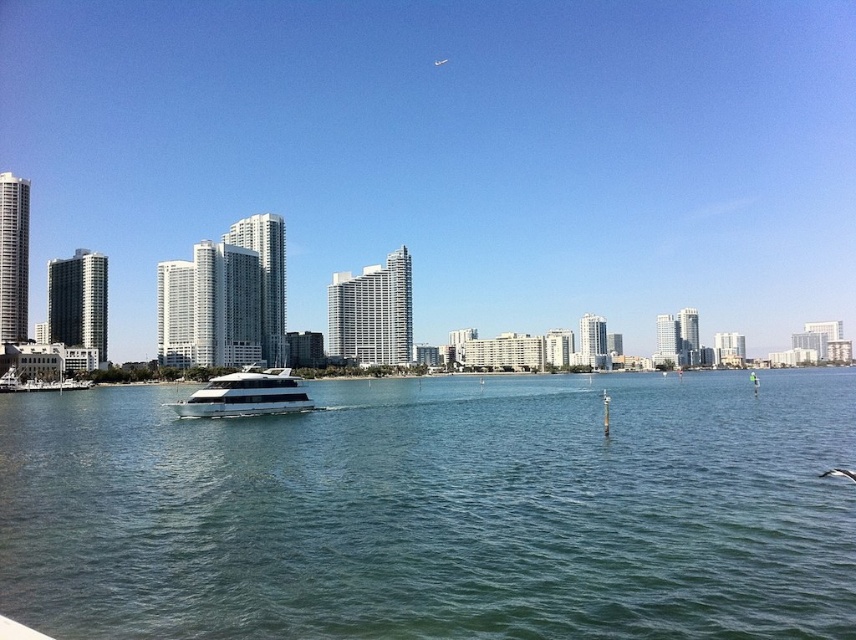
You are standing at the point with coordinates point [257,384] and want to walk to the point with coordinates point [278,544]. Which direction should you go to reach your destination?

To reach point [278,544] from point [257,384], you should move forward since point [278,544] is in front of point [257,384].